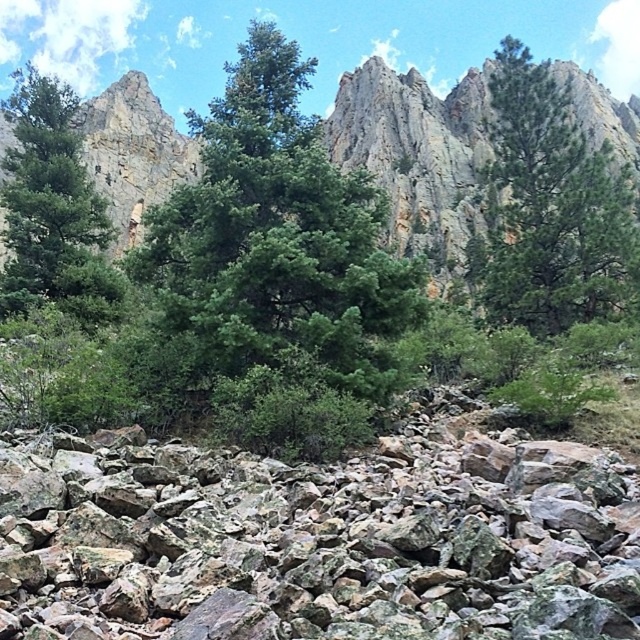
Does green leafy tree at center have a larger size compared to green textured tree at upper right?

→ Incorrect, green leafy tree at center is not larger than green textured tree at upper right.

Who is positioned more to the left, green leafy tree at center or green textured tree at upper right?

green leafy tree at center

Between point (253, 326) and point (609, 204), which one is positioned behind?

Point (609, 204)

Identify the location of green leafy tree at center. (276, 266).

Between point (385, 81) and point (502, 65), which one is positioned in front?

Point (502, 65)

Between green leafy trees at center and green textured tree at upper right, which one has less height?

Standing shorter between the two is green textured tree at upper right.

Is point (426, 161) positioned in front of point (592, 189)?

No.

Identify the location of green leafy trees at center. The height and width of the screenshot is (640, 640). (417, 154).

Is gray rough rocks at center shorter than green leafy tree at center?

Indeed, gray rough rocks at center has a lesser height compared to green leafy tree at center.

Describe the element at coordinates (320, 540) in the screenshot. I see `gray rough rocks at center` at that location.

I want to click on gray rough rocks at center, so [x=320, y=540].